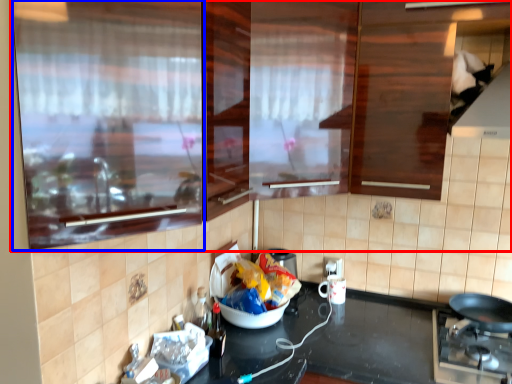
Question: Which object is further to the camera taking this photo, cabinetry (highlighted by a red box) or glass door (highlighted by a blue box)?

Choices:
 (A) cabinetry
 (B) glass door

Answer: (B)